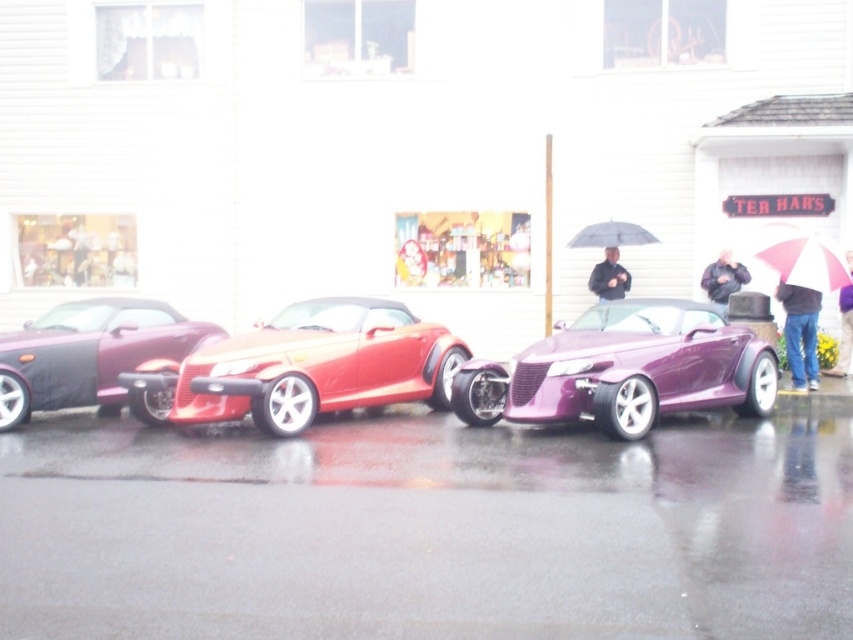
You are a delivery person holding a small package and need to choose an umbrella to protect yourself from the rain. You see a white and pink striped umbrella at upper right and a pink fabric umbrella at upper right. Which umbrella should you choose to provide better coverage?

The white and pink striped umbrella at upper right is larger in size than the pink fabric umbrella at upper right, so you should choose the white and pink striped umbrella at upper right for better coverage.

You are standing on the wet street in front of the building with the cars. You want to pick up the jeans at lower right and the transparent plastic umbrella at center. Which item should you reach for first to avoid getting wet from the rain?

You should reach for the jeans at lower right first because it is closer to you than the transparent plastic umbrella at center, so you can grab it without moving further into the rain.

Looking at this image, you are standing at the point with coordinates (x=805, y=262) in the image. What object are you standing on?

You are standing on the white and pink striped umbrella at upper right.